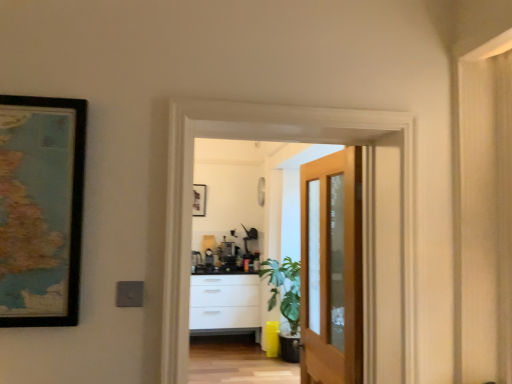
This screenshot has height=384, width=512. What do you see at coordinates (284, 140) in the screenshot?
I see `wooden screen door at center` at bounding box center [284, 140].

Find the location of `light brown wooden door at center`. light brown wooden door at center is located at coordinates (331, 269).

Locate an element on the screen. This screenshot has height=384, width=512. wooden-framed map at left is located at coordinates (41, 209).

Would you say wooden-framed map at left is outside wooden screen door at center?

Yes, wooden-framed map at left is located beyond the bounds of wooden screen door at center.

Where is `picture frame on the left of wooden screen door at center`? The image size is (512, 384). picture frame on the left of wooden screen door at center is located at coordinates (41, 209).

Considering the positions of objects wooden-framed map at left and wooden screen door at center in the image provided, who is more to the left, wooden-framed map at left or wooden screen door at center?

From the viewer's perspective, wooden-framed map at left appears more on the left side.

How many degrees apart are the facing directions of wooden-framed map at left and wooden screen door at center?

They differ by 0.00265 degrees in their facing directions.

How many degrees apart are the facing directions of wooden-framed map at left and light brown wooden door at center?

They differ by 90 degrees in their facing directions.

From the image's perspective, is wooden-framed map at left on top of light brown wooden door at center?

Indeed, from the image's perspective, wooden-framed map at left is shown above light brown wooden door at center.

Which is closer, (8, 323) or (353, 161)?

Clearly, point (8, 323) is closer to the camera than point (353, 161).

Considering the sizes of objects wooden-framed map at left and light brown wooden door at center in the image provided, who is shorter, wooden-framed map at left or light brown wooden door at center?

wooden-framed map at left is shorter.

Is point (350, 324) positioned before point (226, 356)?

That is True.

Is light brown wooden door at center far from wooden floor at lower center?

Indeed, light brown wooden door at center is not near wooden floor at lower center.

Does light brown wooden door at center have a lesser width compared to wooden floor at lower center?

Yes.

From the image's perspective, is wooden screen door at center beneath wooden-framed map at left?

Yes, from the image's perspective, wooden screen door at center is below wooden-framed map at left.

Which object is positioned more to the left, wooden screen door at center or wooden-framed map at left?

wooden-framed map at left.

From a real-world perspective, is wooden screen door at center over wooden-framed map at left?

Actually, wooden screen door at center is physically below wooden-framed map at left in the real world.

Could you tell me if light brown wooden door at center is facing wooden-framed map at left?

Yes, light brown wooden door at center is aimed at wooden-framed map at left.

Is light brown wooden door at center bigger than wooden-framed map at left?

Indeed, light brown wooden door at center has a larger size compared to wooden-framed map at left.

Is light brown wooden door at center outside of wooden-framed map at left?

Yes, light brown wooden door at center is located beyond the bounds of wooden-framed map at left.

In the scene shown: Which object is further away from the camera taking this photo, light brown wooden door at center or wooden-framed map at left?

light brown wooden door at center is further away from the camera.

Can you confirm if wooden floor at lower center is wider than wooden screen door at center?

Yes, wooden floor at lower center is wider than wooden screen door at center.

The height and width of the screenshot is (384, 512). In order to click on screen door that is in front of the wooden floor at lower center in this screenshot , I will do `click(284, 140)`.

At what (x,y) coordinates should I click in order to perform the action: click on door below the wooden screen door at center (from the image's perspective). Please return your answer as a coordinate pair (x, y). Looking at the image, I should click on tap(331, 269).

Between light brown wooden door at center and wooden screen door at center, which one has smaller size?

With smaller size is light brown wooden door at center.

Considering the points (327, 213) and (368, 261), which point is behind, point (327, 213) or point (368, 261)?

Point (327, 213)

In the scene shown: From the image's perspective, is light brown wooden door at center on wooden screen door at center?

No.

What are the coordinates of `screen door that appears behind the wooden-framed map at left` in the screenshot? It's located at (284, 140).

Identify the location of picture frame that is above the light brown wooden door at center (from the image's perspective). (41, 209).

Based on their spatial positions, is wooden-framed map at left or wooden floor at lower center further from light brown wooden door at center?

wooden floor at lower center.

When comparing their distances from wooden-framed map at left, does light brown wooden door at center or wooden screen door at center seem closer?

Among the two, wooden screen door at center is located nearer to wooden-framed map at left.

Considering their positions, is wooden floor at lower center positioned closer to wooden screen door at center than wooden-framed map at left?

Based on the image, wooden-framed map at left appears to be nearer to wooden screen door at center.

Looking at the image, which one is located further to wooden-framed map at left, wooden floor at lower center or light brown wooden door at center?

The object further to wooden-framed map at left is wooden floor at lower center.

Considering their positions, is wooden screen door at center positioned further to wooden-framed map at left than wooden floor at lower center?

Among the two, wooden floor at lower center is located further to wooden-framed map at left.

Considering their positions, is wooden floor at lower center positioned closer to light brown wooden door at center than wooden-framed map at left?

wooden-framed map at left lies closer to light brown wooden door at center than the other object.

Based on the photo, based on their spatial positions, is wooden screen door at center or wooden-framed map at left further from wooden floor at lower center?

wooden-framed map at left is further to wooden floor at lower center.

Which object lies further to the anchor point wooden floor at lower center, wooden-framed map at left or wooden screen door at center?

wooden-framed map at left lies further to wooden floor at lower center than the other object.

Identify the location of screen door between wooden-framed map at left and wooden floor at lower center in the front-back direction. (284, 140).

Where is `door between wooden screen door at center and wooden floor at lower center in the front-back direction`? The image size is (512, 384). door between wooden screen door at center and wooden floor at lower center in the front-back direction is located at coordinates (331, 269).

Find the location of a particular element. door between wooden-framed map at left and wooden floor at lower center in the front-back direction is located at coordinates (331, 269).

Identify the location of screen door located between wooden-framed map at left and light brown wooden door at center in the left-right direction. (284, 140).